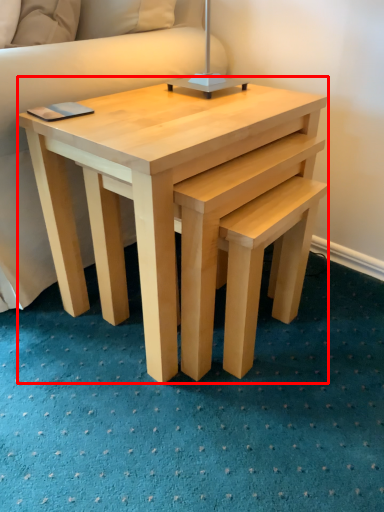
Question: In this image, where is coffee table (annotated by the red box) located relative to table lamp?

Choices:
 (A) right
 (B) left

Answer: (B)